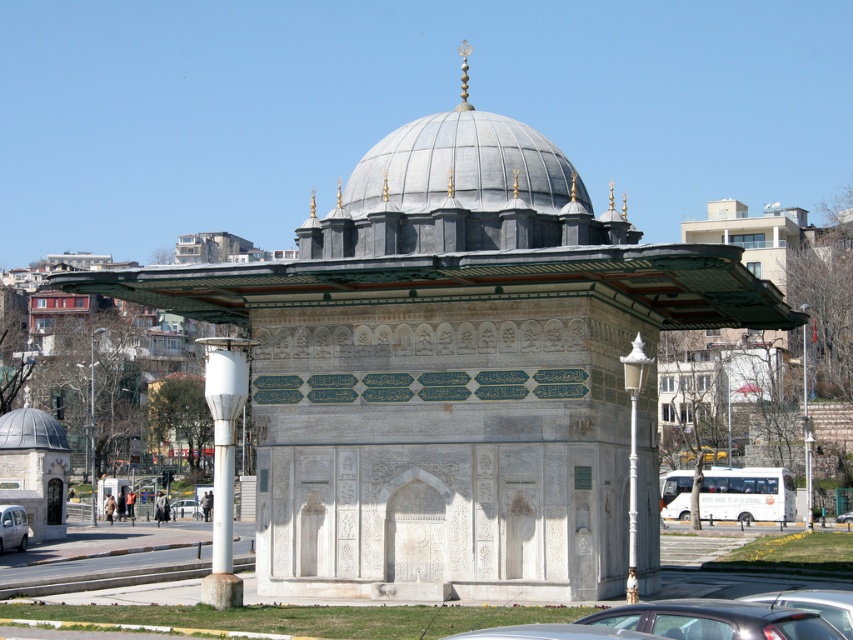
Question: Is metallic gray sedan at lower center further to camera compared to shiny black car at center?

Choices:
 (A) no
 (B) yes

Answer: (A)

Question: Which is farther from the metallic silver car at center?

Choices:
 (A) white matte pillar at center-left
 (B) gray stone dome at center
 (C) white glossy car at center

Answer: (B)

Question: Observing the image, what is the correct spatial positioning of gray stone dome at center in reference to metallic silver car at center?

Choices:
 (A) above
 (B) below

Answer: (A)

Question: Estimate the real-world distances between objects in this image. Which object is farther from the metallic gray sedan at lower center?

Choices:
 (A) white matte pillar at center-left
 (B) metallic silver car at center
 (C) shiny black car at center
 (D) gray stone dome at center

Answer: (B)

Question: Which point is closer to the camera taking this photo?

Choices:
 (A) (180, 513)
 (B) (22, 516)
 (C) (761, 600)
 (D) (845, 515)

Answer: (C)

Question: In this image, where is white matte pillar at center-left located relative to silver metallic car at lower left?

Choices:
 (A) left
 (B) right

Answer: (B)